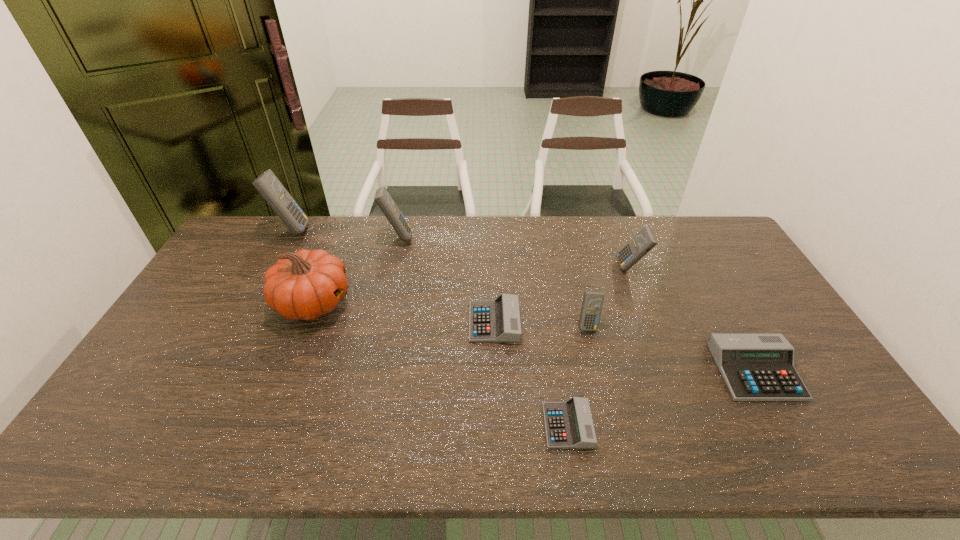
This screenshot has width=960, height=540. In order to click on vacant region at the far edge of the desktop in this screenshot , I will do `click(559, 231)`.

Locate an element on the screen. free space at the near edge of the desktop is located at coordinates (470, 449).

Image resolution: width=960 pixels, height=540 pixels. I want to click on vacant space at the left edge of the desktop, so click(x=205, y=297).

The image size is (960, 540). Find the location of `free spot at the right edge of the desktop`. free spot at the right edge of the desktop is located at coordinates (817, 367).

The height and width of the screenshot is (540, 960). What are the coordinates of `free location at the near left corner of the desktop` in the screenshot? It's located at (128, 447).

The width and height of the screenshot is (960, 540). In the image, there is a desktop. Find the location of `vacant space at the far right corner`. vacant space at the far right corner is located at coordinates (708, 221).

Where is `free spot between the shortest object and the leftmost calculator`? The height and width of the screenshot is (540, 960). free spot between the shortest object and the leftmost calculator is located at coordinates (429, 327).

Find the location of a particular element. This screenshot has width=960, height=540. vacant area that lies between the rightmost calculator and the leftmost gray calculator is located at coordinates (625, 347).

Find the location of a particular element. This screenshot has height=540, width=960. vacant region between the second nearest calculator and the leftmost gray calculator is located at coordinates (625, 347).

Identify the location of blank region between the fifth object from left to right and the seventh object from right to left. (441, 364).